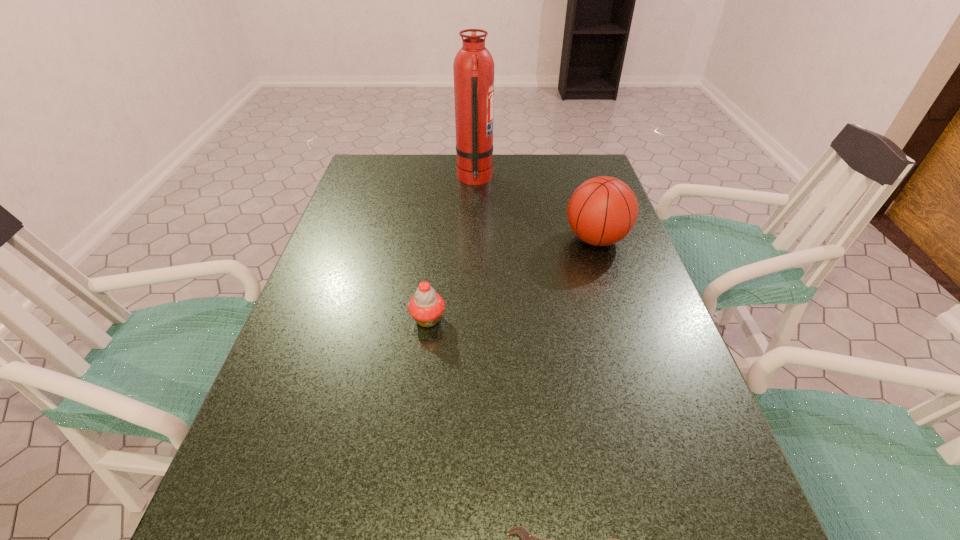
Locate an element on the screen. object that is at the right edge is located at coordinates (602, 211).

Where is `free region at the far edge of the desktop`? This screenshot has width=960, height=540. free region at the far edge of the desktop is located at coordinates click(440, 174).

You are a GUI agent. You are given a task and a screenshot of the screen. Output one action in this format:
    pyautogui.click(x=<x>, y=<y>)
    Task: Click on the free space at the left edge of the desktop
    Image resolution: width=960 pixels, height=540 pixels.
    Given the screenshot: What is the action you would take?
    pyautogui.click(x=301, y=371)

What are the coordinates of `vacant area at the right edge of the desktop` in the screenshot? It's located at (659, 314).

The height and width of the screenshot is (540, 960). Identify the location of vacant area at the far left corner of the desktop. (367, 176).

Where is `free space between the second farthest object and the third tallest object`? This screenshot has width=960, height=540. free space between the second farthest object and the third tallest object is located at coordinates (512, 279).

This screenshot has height=540, width=960. In order to click on free space that is in between the tallest object and the third tallest object in this screenshot , I will do `click(451, 249)`.

This screenshot has height=540, width=960. I want to click on vacant point located between the third shortest object and the third tallest object, so click(x=512, y=279).

Where is `object that is the closest to the wrench`? The image size is (960, 540). object that is the closest to the wrench is located at coordinates (426, 307).

In order to click on the third closest object relative to the wrench in this screenshot , I will do `click(473, 67)`.